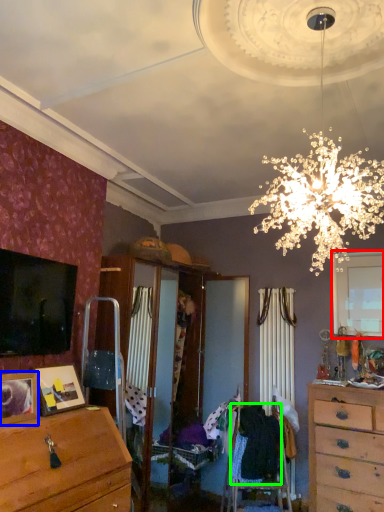
Question: Which object is positioned farthest from window (highlighted by a red box)? Select from picture frame (highlighted by a blue box) and clothing (highlighted by a green box).

Choices:
 (A) picture frame
 (B) clothing

Answer: (A)